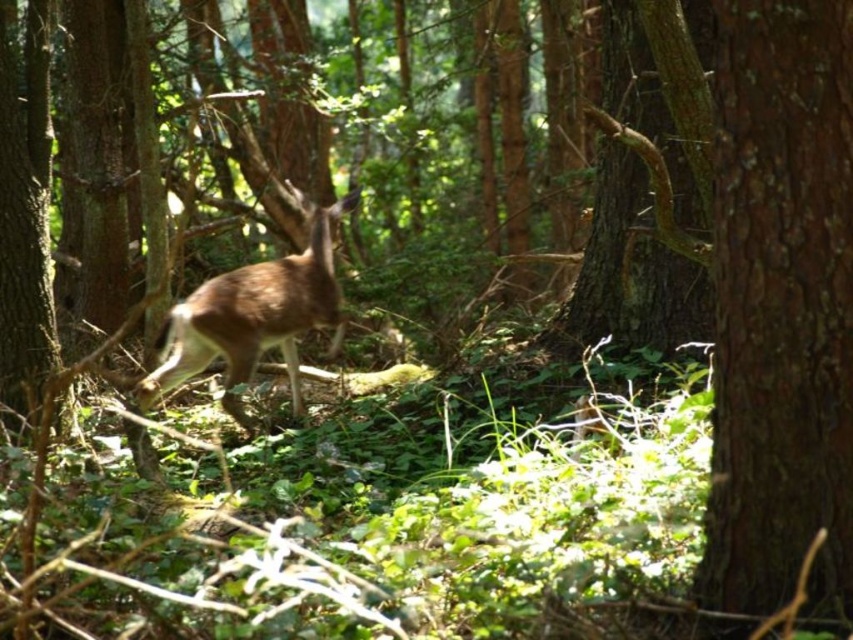
Question: Which object appears farthest from the camera in this image?

Choices:
 (A) brown rough bark tree at center right
 (B) brown matte/deer at center

Answer: (B)

Question: Can you confirm if brown rough bark tree at center right is positioned above brown matte/deer at center?

Choices:
 (A) yes
 (B) no

Answer: (A)

Question: Where is brown rough bark tree at center right located in relation to brown matte/deer at center in the image?

Choices:
 (A) right
 (B) left

Answer: (A)

Question: Does brown rough bark tree at center right have a larger size compared to brown matte/deer at center?

Choices:
 (A) no
 (B) yes

Answer: (A)

Question: Among these points, which one is farthest from the camera?

Choices:
 (A) (289, 330)
 (B) (844, 90)

Answer: (A)